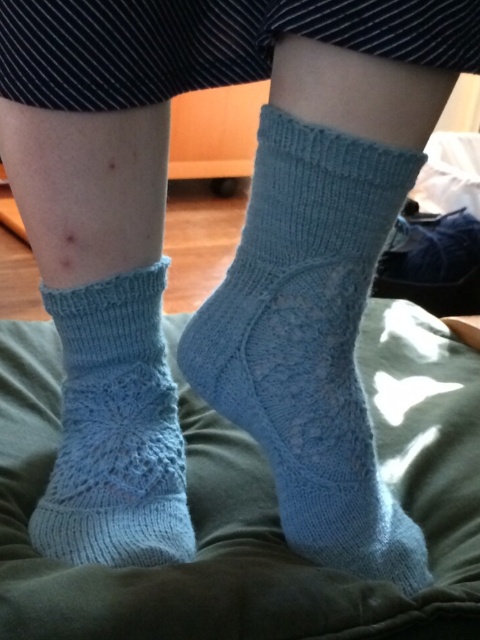
Question: Is light blue knitted socks at lower center smaller than light blue knitted socks at center?

Choices:
 (A) no
 (B) yes

Answer: (A)

Question: Which point is closer to the camera?

Choices:
 (A) light blue knitted sock at lower left
 (B) light blue knitted socks at center

Answer: (B)

Question: Which object is farther from the camera taking this photo?

Choices:
 (A) light blue knitted socks at center
 (B) light blue knitted socks at lower center
 (C) light blue knitted sock at lower left

Answer: (C)

Question: Does light blue knitted socks at lower center have a larger size compared to light blue knitted socks at center?

Choices:
 (A) no
 (B) yes

Answer: (B)

Question: Can you confirm if light blue knitted socks at lower center is positioned below light blue knitted socks at center?

Choices:
 (A) no
 (B) yes

Answer: (A)

Question: Which of the following is the closest to the observer?

Choices:
 (A) light blue knitted socks at lower center
 (B) light blue knitted sock at lower left

Answer: (A)